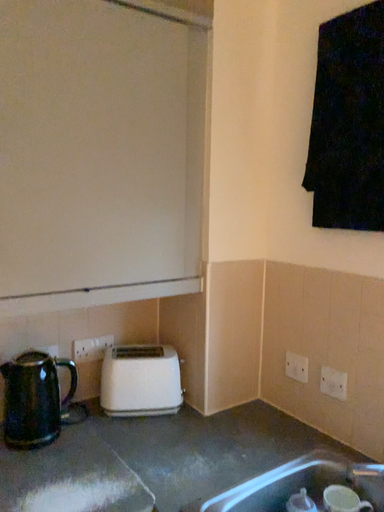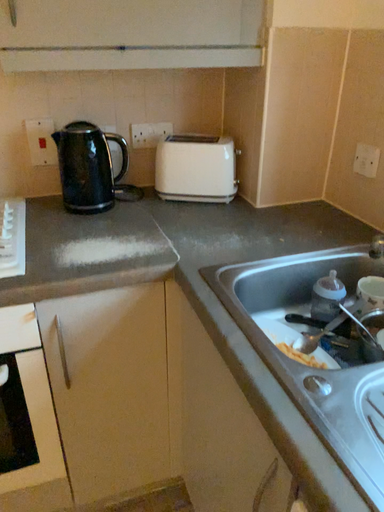
Question: Which way did the camera rotate in the video?

Choices:
 (A) rotated downward
 (B) rotated upward

Answer: (A)